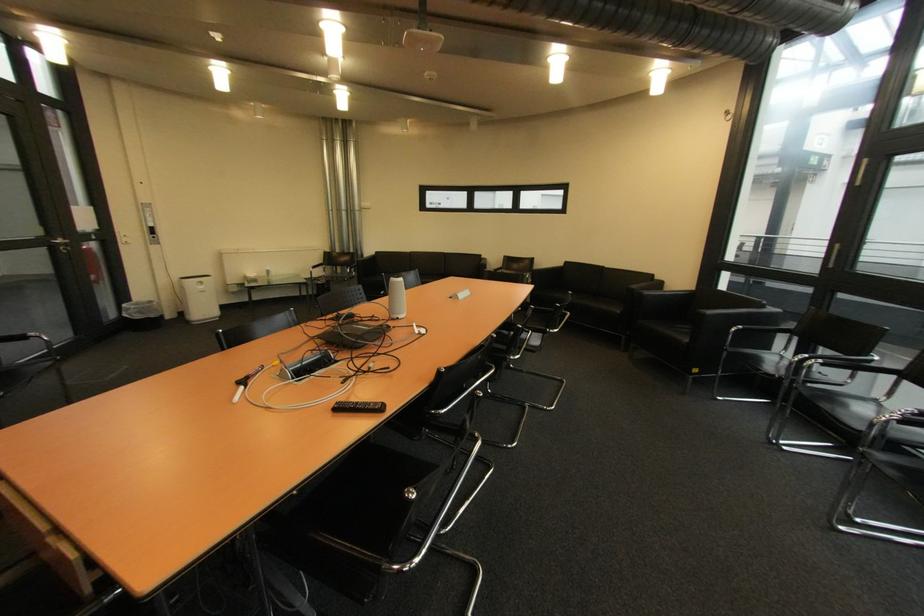
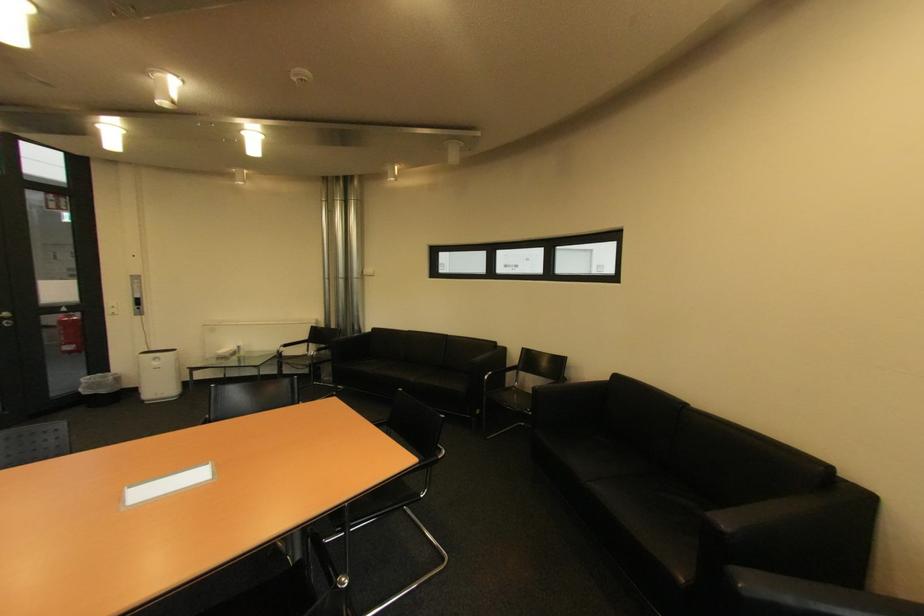
In the second image, find the point that corresponds to point 575,264 in the first image.

(625, 378)